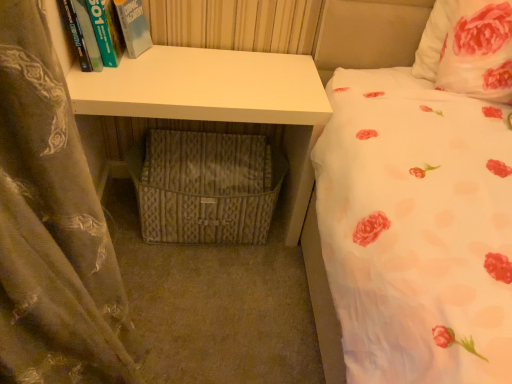
Question: Is brown sheer curtain at left to the left or to the right of hardcover book at upper left in the image?

Choices:
 (A) left
 (B) right

Answer: (B)

Question: From the image's perspective, is brown sheer curtain at left located above or below hardcover book at upper left?

Choices:
 (A) below
 (B) above

Answer: (A)

Question: Which of these objects is positioned closest to the white floral fabric pillow at upper right?

Choices:
 (A) white matte desk at center
 (B) brown sheer curtain at left
 (C) woven fabric crate at lower center
 (D) hardcover book at upper left

Answer: (A)

Question: Considering the real-world distances, which object is closest to the brown sheer curtain at left?

Choices:
 (A) woven fabric crate at lower center
 (B) hardcover book at upper left
 (C) white matte desk at center
 (D) white floral fabric pillow at upper right

Answer: (C)